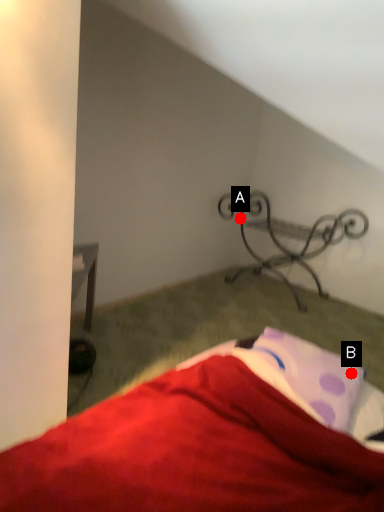
Question: Two points are circled on the image, labeled by A and B beside each circle. Which point is farther to the camera?

Choices:
 (A) A is further
 (B) B is further

Answer: (A)